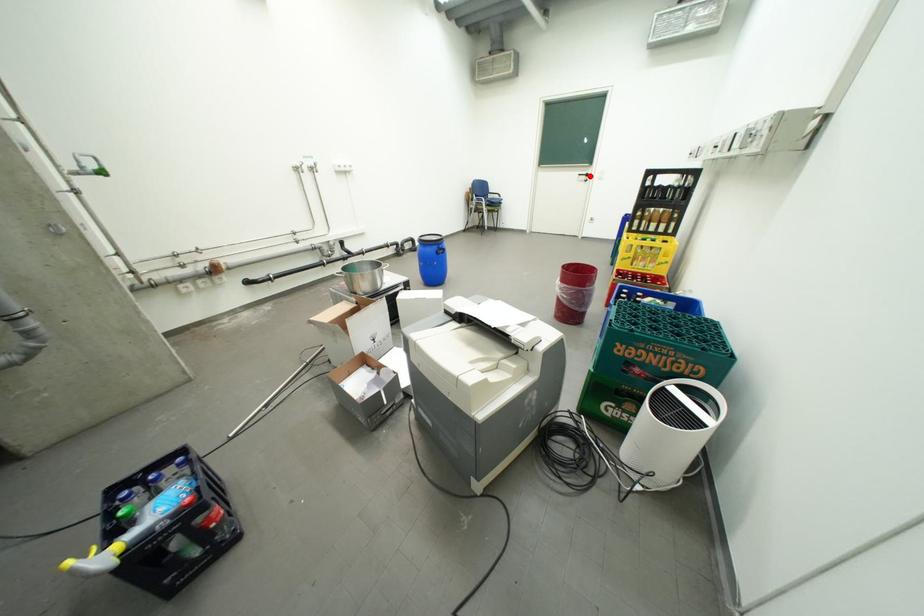
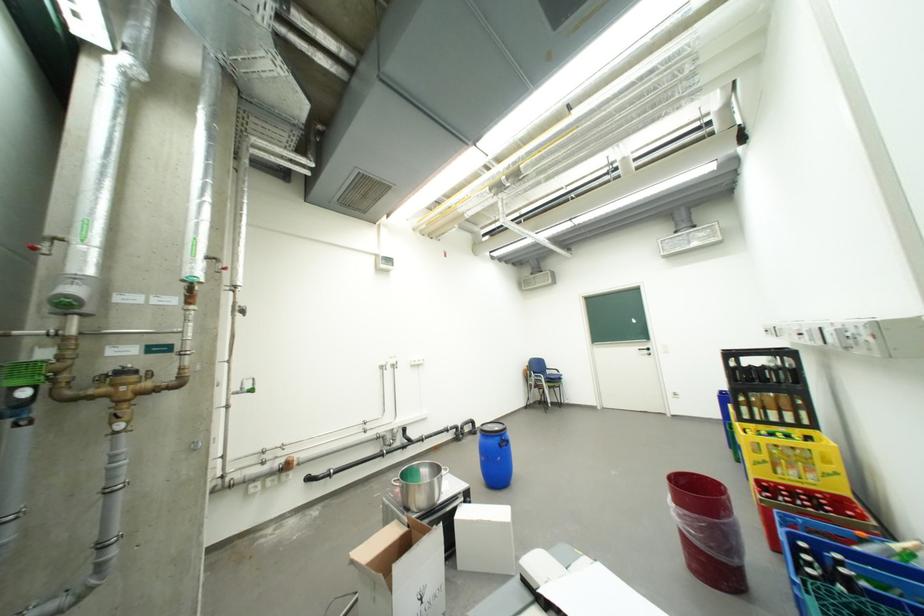
In the second image, find the point that corresponds to the highlighted location in the first image.

(650, 351)